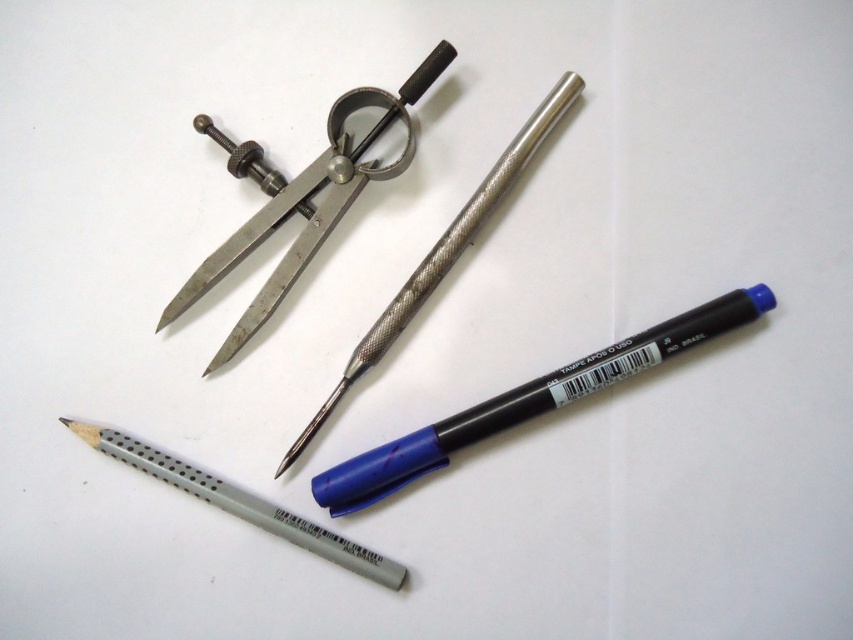
You are an architect reviewing the layout of tools on a desk. You need to determine which point is closer to you between point (206, 285) and point (544, 109). Based on the image, which point is closer?

Point (206, 285) is closer to you than point (544, 109).

Which object is located at the coordinates point (x=309, y=202)?

The point (x=309, y=202) is on the metallic textured scissors at upper center.

You are an architect designing a blueprint and need to choose between the metallic textured pencil at center and the gray matte pencil at lower center for precision drawing. Based on their widths, which pencil would be more suitable for fine details?

The metallic textured pencil at center has a lesser width compared to the gray matte pencil at lower center, making it more suitable for precision and fine details due to its narrower profile.